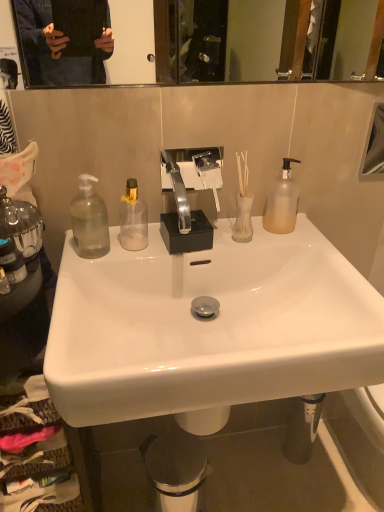
What are the coordinates of `free space in front of transparent plastic bottle at center, acting as the 2th bottle starting from the right` in the screenshot? It's located at (104, 267).